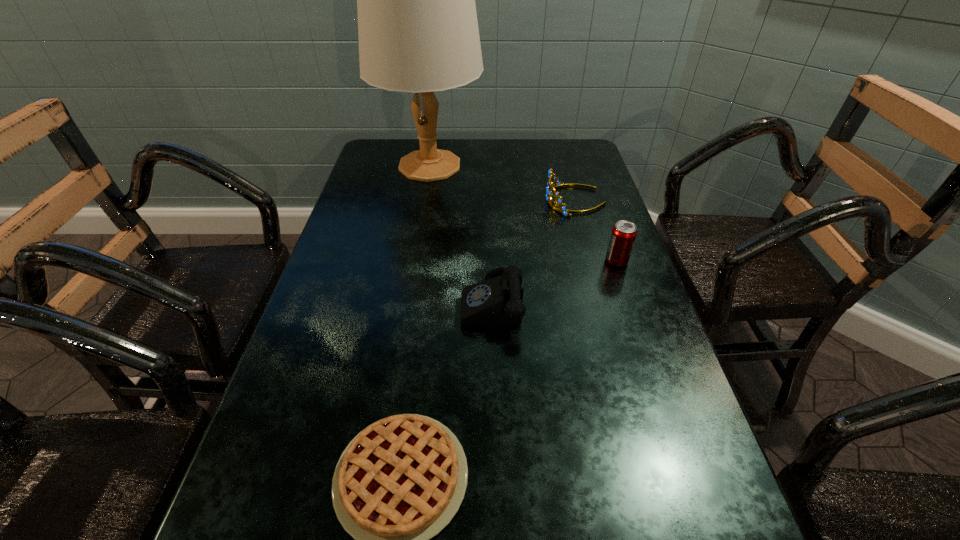
The width and height of the screenshot is (960, 540). What are the coordinates of `table lamp` in the screenshot? It's located at (418, 32).

Identify the location of soda can. (623, 235).

Locate an element on the screen. This screenshot has width=960, height=540. tiara is located at coordinates (562, 209).

Identify the location of the fourth farthest object. (496, 302).

The image size is (960, 540). I want to click on free spot located 0.200m on the right of the table lamp, so click(x=545, y=166).

You are a GUI agent. You are given a task and a screenshot of the screen. Output one action in this format:
    pyautogui.click(x=<x>, y=<y>)
    Task: Click on the blank space located on the front of the soda can
    
    Given the screenshot: What is the action you would take?
    pyautogui.click(x=654, y=370)

Identify the location of free space located 0.130m on the front-facing side of the tiara. This screenshot has width=960, height=540. coord(499,201).

Where is `free space located on the front-facing side of the tiara`? free space located on the front-facing side of the tiara is located at coordinates (447, 201).

Identify the location of vacant space located 0.280m on the front-facing side of the tiara. (447, 201).

This screenshot has height=540, width=960. I want to click on blank space located 0.160m on the dial of the second nearest object, so click(389, 301).